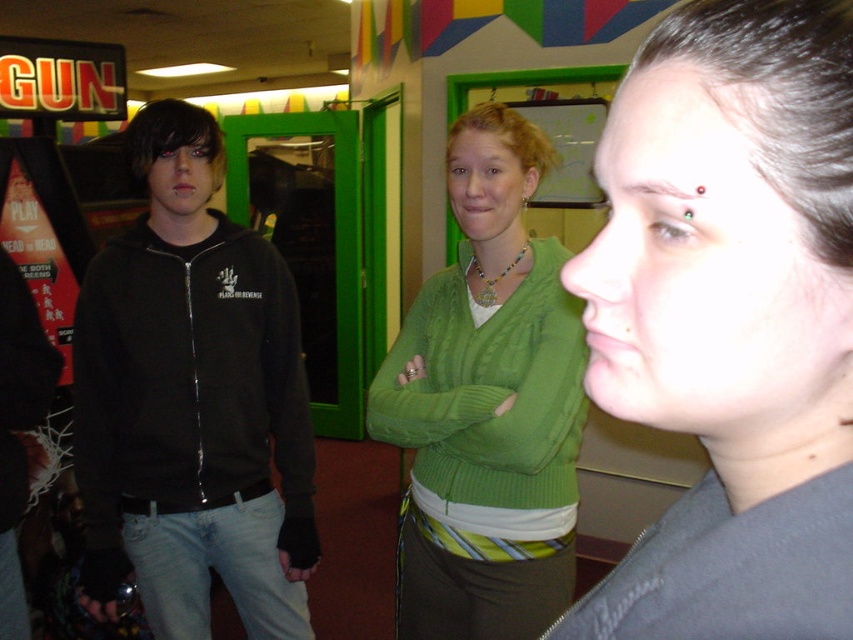
Can you confirm if matte black forehead at upper center is smaller than green knitted sweater at center?

Yes, matte black forehead at upper center is smaller than green knitted sweater at center.

Can you confirm if matte black forehead at upper center is bigger than green knitted sweater at center?

No, matte black forehead at upper center is not bigger than green knitted sweater at center.

Which is behind, point (749, 202) or point (503, 476)?

The point (503, 476) is behind.

Identify the location of matte black forehead at upper center. The image size is (853, 640). (730, 320).

At what (x,y) coordinates should I click in order to perform the action: click on matte black forehead at upper center. Please return your answer as a coordinate pair (x, y). The width and height of the screenshot is (853, 640). Looking at the image, I should click on (730, 320).

In the scene shown: Can you confirm if matte black forehead at upper center is smaller than black zip-up hoodie at left?

Yes.

Between point (737, 1) and point (221, 294), which one is positioned in front?

Point (737, 1)

Identify the location of matte black forehead at upper center. This screenshot has height=640, width=853. (730, 320).

Is black zip-up hoodie at left below green knitted sweater at center?

Correct, black zip-up hoodie at left is located below green knitted sweater at center.

In the scene shown: Does black zip-up hoodie at left come in front of green knitted sweater at center?

No, black zip-up hoodie at left is further to the viewer.

Is point (215, 566) farther from viewer compared to point (515, 598)?

Yes, point (215, 566) is behind point (515, 598).

Image resolution: width=853 pixels, height=640 pixels. Identify the location of black zip-up hoodie at left. (192, 403).